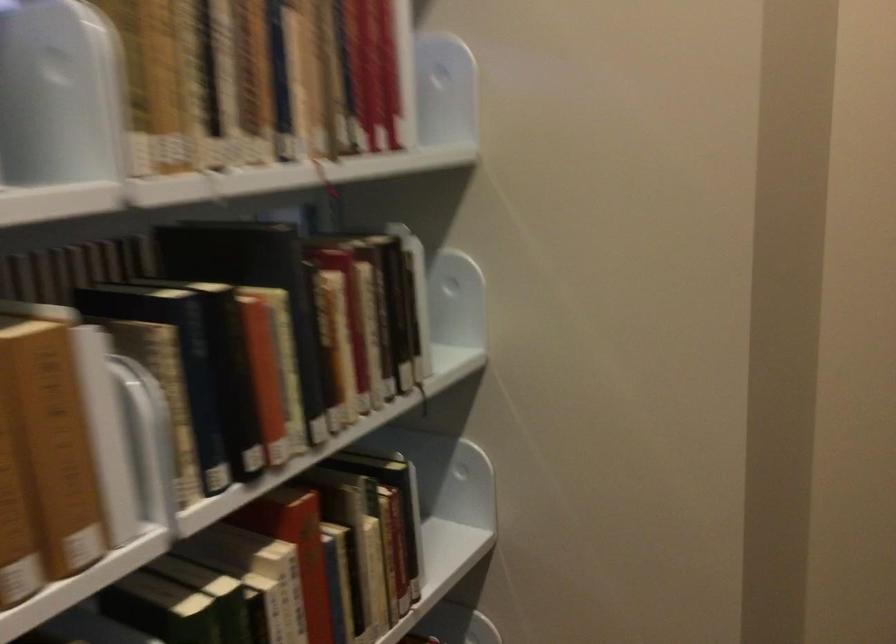
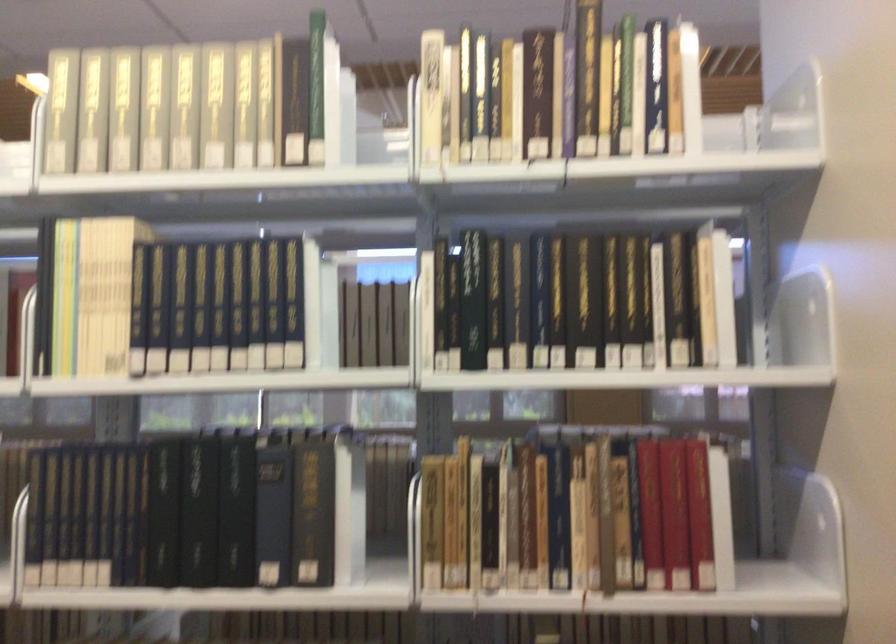
Question: The camera is either moving clockwise (left) or counter-clockwise (right) around the object. The first image is from the beginning of the video and the second image is from the end. Is the camera moving left or right when shooting the video?

Choices:
 (A) Left
 (B) Right

Answer: (B)